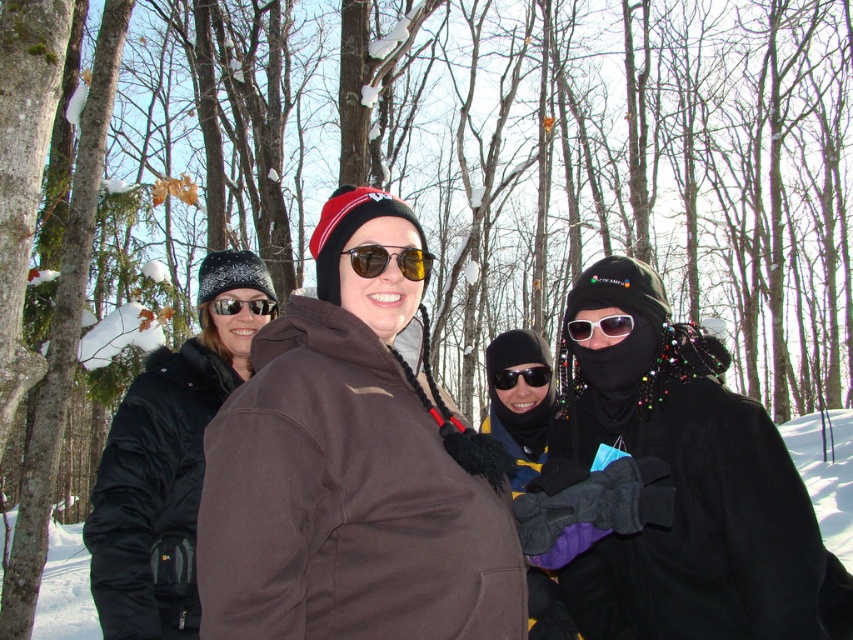
The width and height of the screenshot is (853, 640). I want to click on white matte sunglasses at center, so click(x=601, y=326).

Image resolution: width=853 pixels, height=640 pixels. Describe the element at coordinates (601, 326) in the screenshot. I see `white matte sunglasses at center` at that location.

This screenshot has width=853, height=640. What are the coordinates of `white matte sunglasses at center` in the screenshot? It's located at (601, 326).

Can you confirm if black fuzzy jacket at left is positioned below yellow reflective sunglasses at center?

Yes.

Who is more distant from viewer, (161, 616) or (363, 268)?

Point (161, 616)

Find the location of a particular element. black fuzzy jacket at left is located at coordinates (167, 464).

Is brown fleece jacket at center positioned in front of matte black sunglasses at center?

Yes, it is in front of matte black sunglasses at center.

Who is higher up, brown fleece jacket at center or matte black sunglasses at center?

matte black sunglasses at center is higher up.

Measure the distance between brown fleece jacket at center and camera.

The distance of brown fleece jacket at center from camera is 1.62 meters.

Where is `brown fleece jacket at center`? This screenshot has height=640, width=853. brown fleece jacket at center is located at coordinates (351, 472).